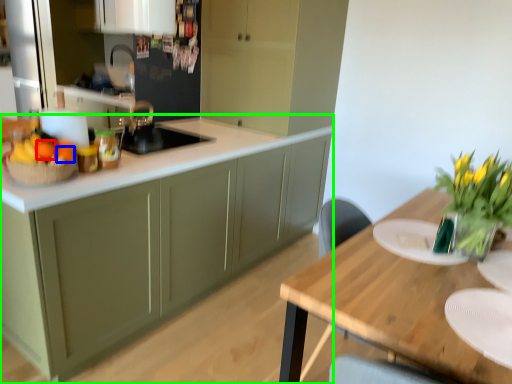
Question: Based on their relative distances, which object is nearer to tangerine (highlighted by a red box)? Choose from orange (highlighted by a blue box) and cabinetry (highlighted by a green box).

Choices:
 (A) orange
 (B) cabinetry

Answer: (A)